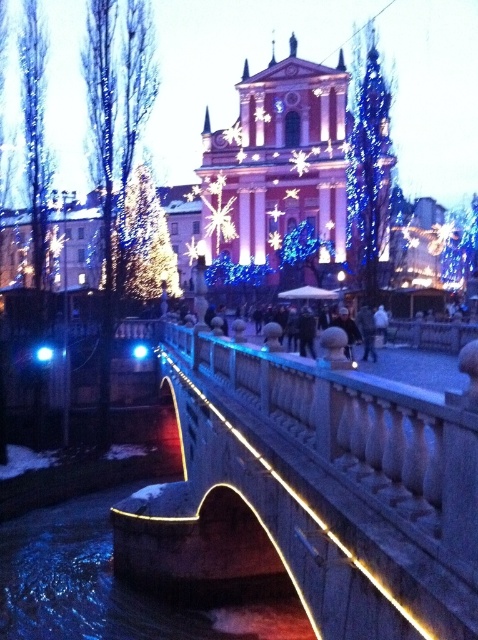
Looking at this image, does illuminated stone bridge at center have a larger size compared to illuminated water at bridge center?

Yes, illuminated stone bridge at center is bigger than illuminated water at bridge center.

Which is behind, point (351, 541) or point (58, 532)?

Point (58, 532)

Find the location of `illuminated stone bridge at center`. illuminated stone bridge at center is located at coordinates (312, 492).